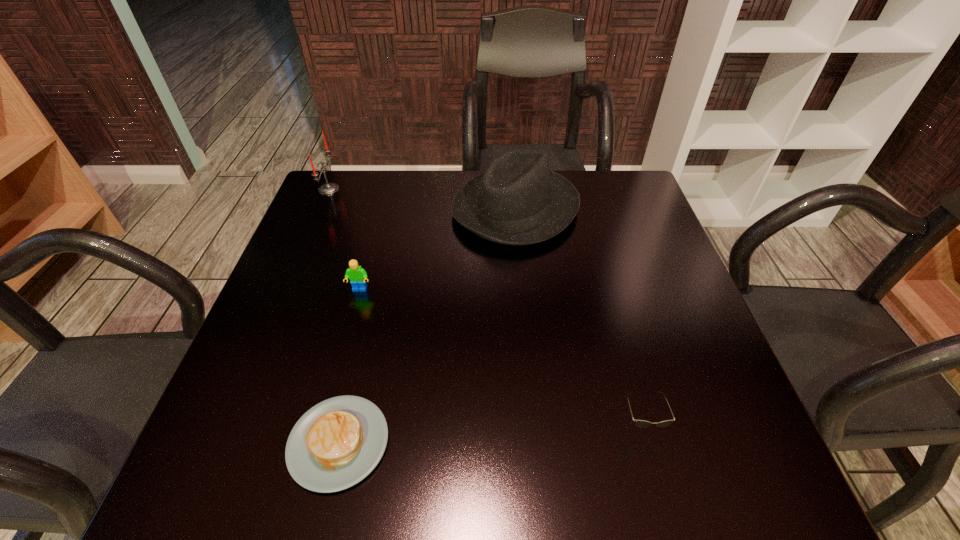
You are a GUI agent. You are given a task and a screenshot of the screen. Output one action in this format:
    pyautogui.click(x=<x>, y=<y>)
    Task: Click on the candle
    The image size is (960, 540).
    Given the screenshot: What is the action you would take?
    pyautogui.click(x=328, y=188)

Find the location of a particular element. The width and height of the screenshot is (960, 540). fedora is located at coordinates (518, 201).

Identify the location of the third farthest object. The image size is (960, 540). (357, 275).

You are a GUI agent. You are given a task and a screenshot of the screen. Output one action in this format:
    pyautogui.click(x=<x>, y=<y>)
    Task: Click on the sunglasses
    
    Given the screenshot: What is the action you would take?
    pyautogui.click(x=639, y=423)

Where is `the shortest object`? The image size is (960, 540). the shortest object is located at coordinates (337, 443).

This screenshot has height=540, width=960. I want to click on free point located on the front-facing side of the leftmost object, so click(453, 189).

Locate an element on the screen. vacant region located 0.260m on the left of the fedora is located at coordinates (x=354, y=209).

At what (x,y) coordinates should I click in order to perform the action: click on free space located 0.160m on the face of the third farthest object. Please return your answer as a coordinate pair (x, y). Looking at the image, I should click on coord(343,355).

The width and height of the screenshot is (960, 540). Find the location of `vacant area situated on the back of the shortest object`. vacant area situated on the back of the shortest object is located at coordinates (359, 355).

Image resolution: width=960 pixels, height=540 pixels. What are the coordinates of `candle situated at the far edge` in the screenshot? It's located at (328, 188).